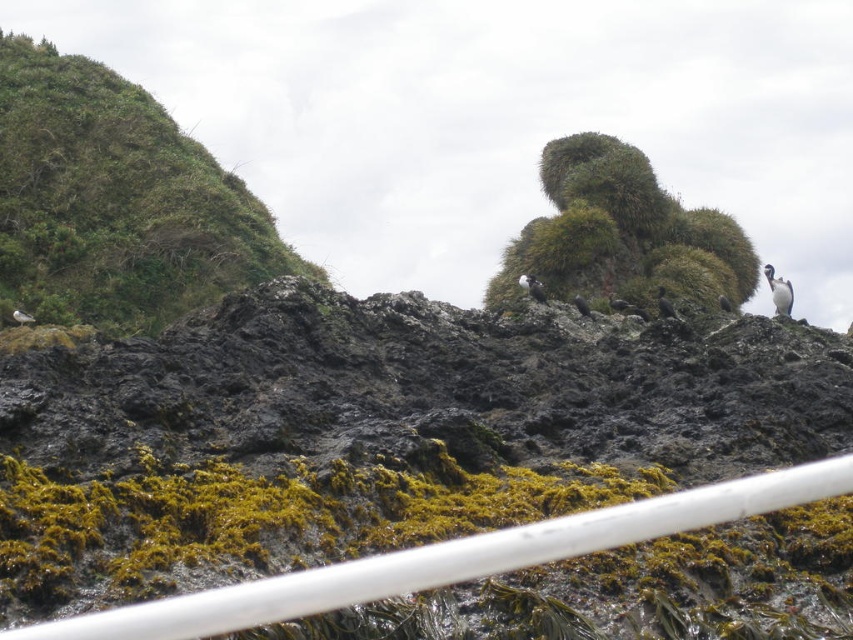
Who is positioned more to the left, green mossy rock at center or white fluffy bird at upper right?

Positioned to the left is green mossy rock at center.

Which is in front, point (664, 195) or point (764, 275)?

Positioned in front is point (764, 275).

Find the location of a particular element. green mossy rock at center is located at coordinates (624, 232).

Is green mossy rock at center below black glossy penguin at center-right?

No, green mossy rock at center is not below black glossy penguin at center-right.

Which is more to the right, green mossy rock at center or black glossy penguin at center-right?

From the viewer's perspective, green mossy rock at center appears more on the right side.

In order to click on green mossy rock at center in this screenshot , I will do `click(624, 232)`.

Consider the image. Can you confirm if black glossy penguin at center-right is wider than white feathered bird at lower left?

Indeed, black glossy penguin at center-right has a greater width compared to white feathered bird at lower left.

Is black glossy penguin at center-right shorter than white feathered bird at lower left?

In fact, black glossy penguin at center-right may be taller than white feathered bird at lower left.

Image resolution: width=853 pixels, height=640 pixels. What do you see at coordinates (665, 305) in the screenshot?
I see `black glossy penguin at center-right` at bounding box center [665, 305].

Where is `black glossy penguin at center-right`? This screenshot has height=640, width=853. black glossy penguin at center-right is located at coordinates (665, 305).